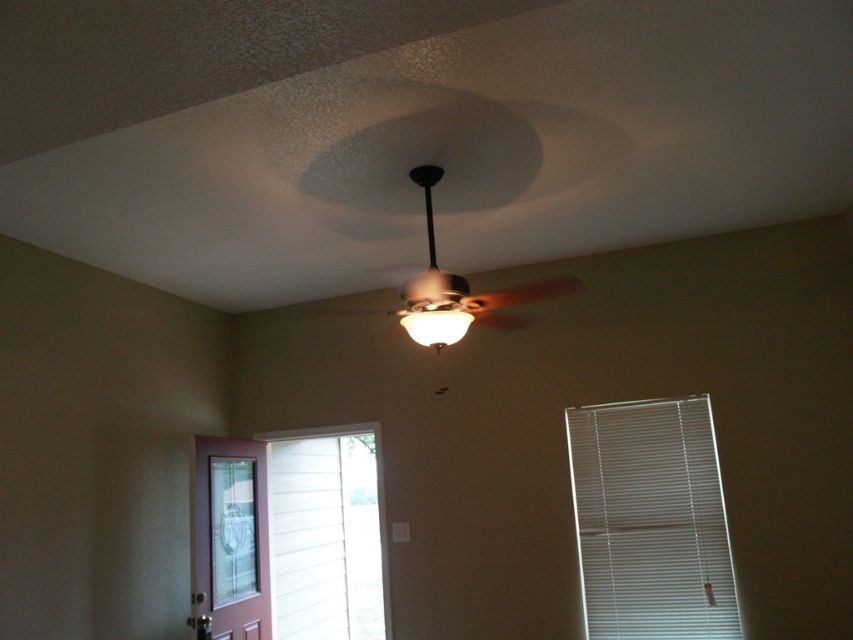
Question: Does metallic silver fan at center have a larger size compared to matte white lamp at center?

Choices:
 (A) no
 (B) yes

Answer: (B)

Question: Observing the image, what is the correct spatial positioning of metallic silver fan at center in reference to matte white lamp at center?

Choices:
 (A) right
 (B) left

Answer: (A)

Question: Is white plastic blinds at right to the left of metallic silver fan at center from the viewer's perspective?

Choices:
 (A) no
 (B) yes

Answer: (A)

Question: Among these objects, which one is nearest to the camera?

Choices:
 (A) matte white lamp at center
 (B) metallic silver fan at center

Answer: (A)

Question: Which object appears farthest from the camera in this image?

Choices:
 (A) white plastic blinds at right
 (B) metallic silver fan at center
 (C) matte white lamp at center

Answer: (A)

Question: Which of these objects is positioned farthest from the matte white lamp at center?

Choices:
 (A) white plastic blinds at right
 (B) metallic silver fan at center

Answer: (A)